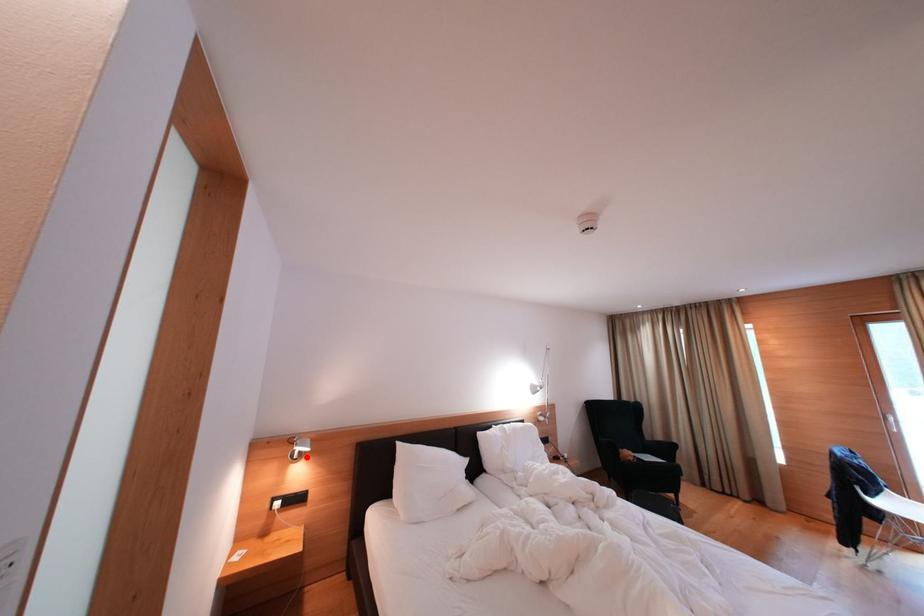
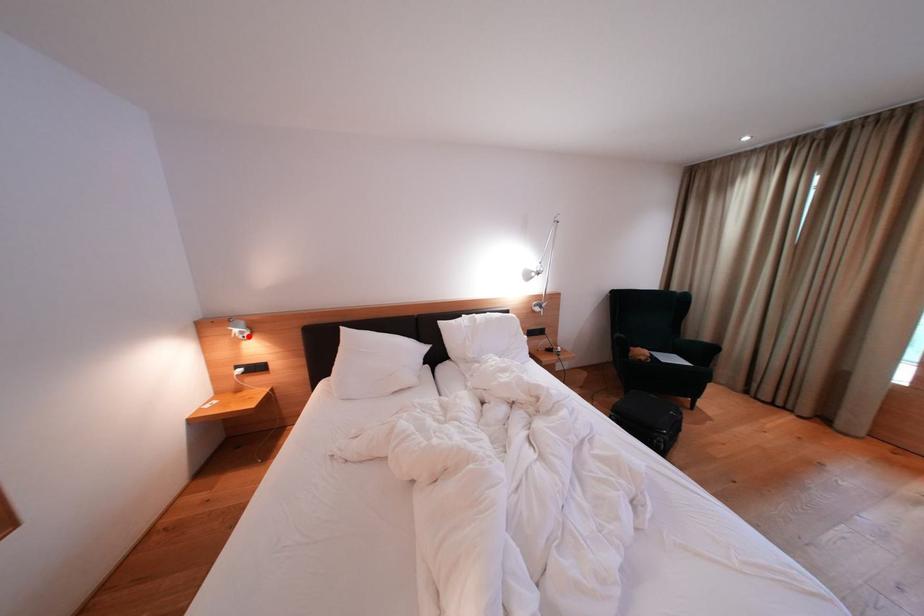
I am providing you with two images of the same scene from different viewpoints. A red point is marked on the first image and another point is marked on the second image. Does the point marked in image1 correspond to the same location as the one in image2?

Yes